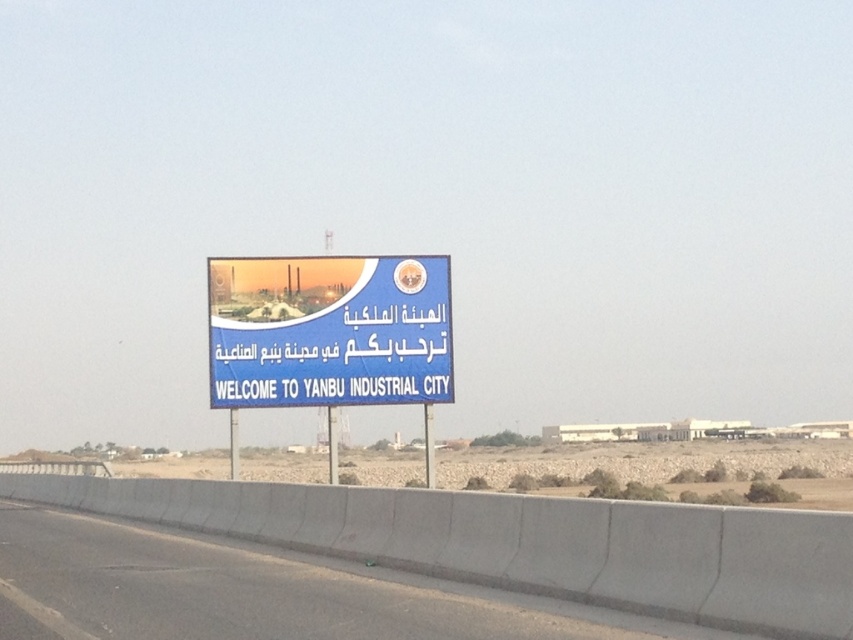
Question: Which of the following is the farthest from the observer?

Choices:
 (A) blue plastic signboard at center
 (B) gray concrete barrier at lower center

Answer: (A)

Question: Which point appears closest to the camera in this image?

Choices:
 (A) (283, 573)
 (B) (383, 272)

Answer: (A)

Question: Can you confirm if gray concrete barrier at lower center is bigger than blue plastic signboard at center?

Choices:
 (A) no
 (B) yes

Answer: (B)

Question: Can you confirm if gray concrete barrier at lower center is smaller than blue plastic signboard at center?

Choices:
 (A) no
 (B) yes

Answer: (A)

Question: Considering the relative positions of gray concrete barrier at lower center and blue plastic signboard at center in the image provided, where is gray concrete barrier at lower center located with respect to blue plastic signboard at center?

Choices:
 (A) above
 (B) below

Answer: (B)